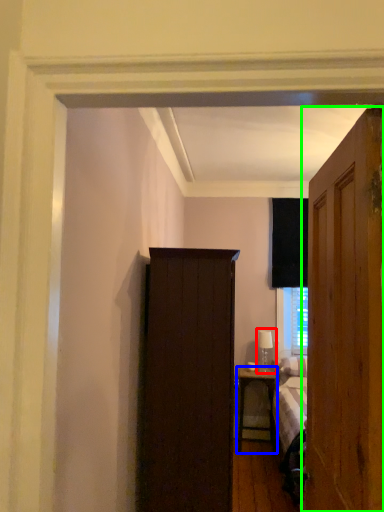
Question: Which object is positioned closest to table lamp (highlighted by a red box)? Select from nightstand (highlighted by a blue box) and door (highlighted by a green box).

Choices:
 (A) nightstand
 (B) door

Answer: (A)